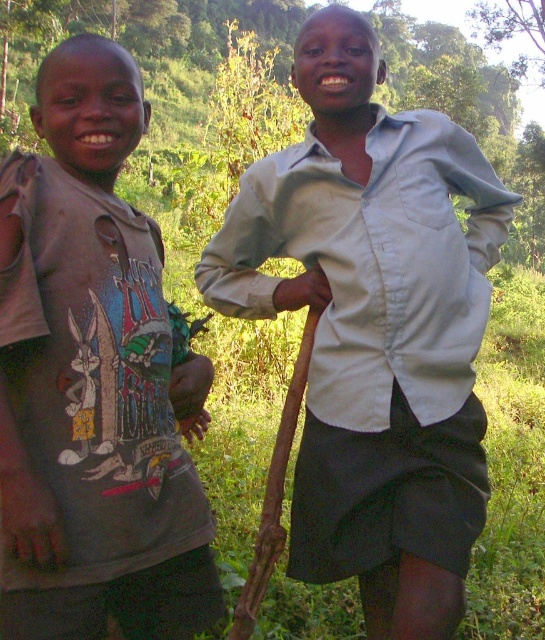
Between light blue cotton shirt at center and matte gray t-shirt at left, which one appears on the left side from the viewer's perspective?

Positioned to the left is matte gray t-shirt at left.

Can you confirm if light blue cotton shirt at center is positioned to the right of matte gray t-shirt at left?

Yes, light blue cotton shirt at center is to the right of matte gray t-shirt at left.

I want to click on light blue cotton shirt at center, so click(x=374, y=328).

The height and width of the screenshot is (640, 545). Find the location of `light blue cotton shirt at center`. light blue cotton shirt at center is located at coordinates (374, 328).